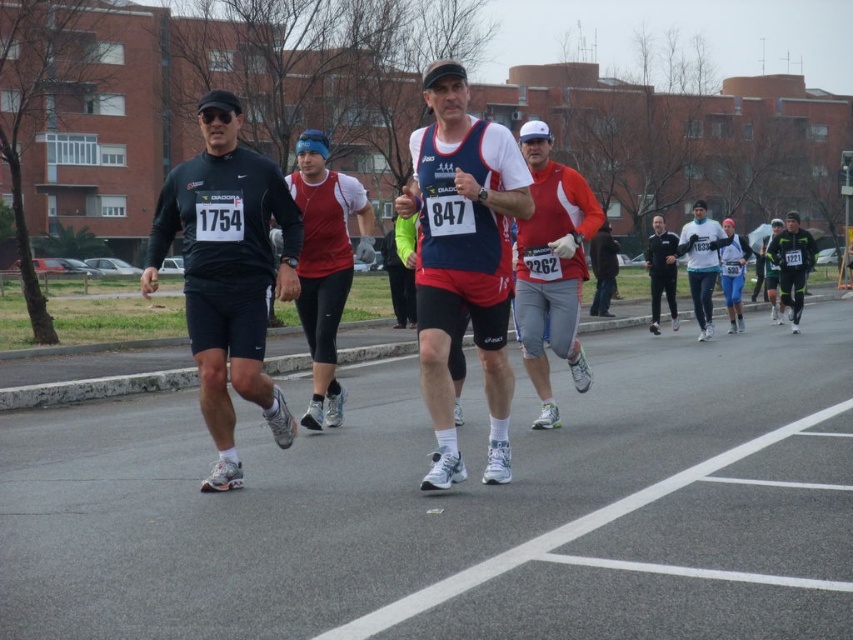
Who is shorter, matte black running suit at left or matte black jacket at center?

With less height is matte black running suit at left.

Is the position of matte black running suit at left more distant than that of matte black jacket at center?

No.

You are a GUI agent. You are given a task and a screenshot of the screen. Output one action in this format:
    pyautogui.click(x=<x>, y=<y>)
    Task: Click on the matte black running suit at left
    
    Given the screenshot: What is the action you would take?
    pyautogui.click(x=227, y=273)

Based on the photo, does matte red shirt at center have a lesser width compared to matte black jacket at center?

Yes.

Is point (570, 259) positioned in front of point (670, 305)?

That is True.

Find the location of a particular element. matte red shirt at center is located at coordinates (550, 268).

Does point (473, 260) come behind point (666, 298)?

No, (473, 260) is closer to viewer.

In the scene shown: Does matte blue tank top at center have a larger size compared to matte black jacket at center?

No.

What do you see at coordinates (463, 260) in the screenshot? I see `matte blue tank top at center` at bounding box center [463, 260].

Locate an element on the screen. matte blue tank top at center is located at coordinates (463, 260).